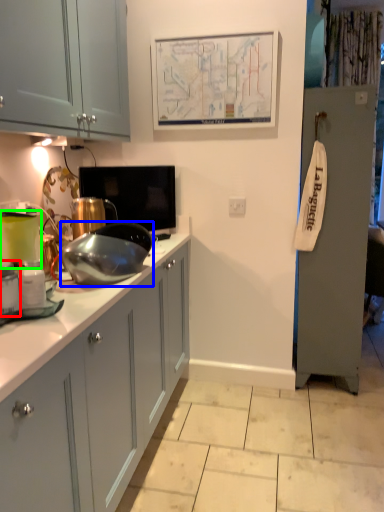
Question: Which is nearer to the kitchen appliance (highlighted by a red box)? appliance (highlighted by a blue box) or home appliance (highlighted by a green box).

Choices:
 (A) appliance
 (B) home appliance

Answer: (B)